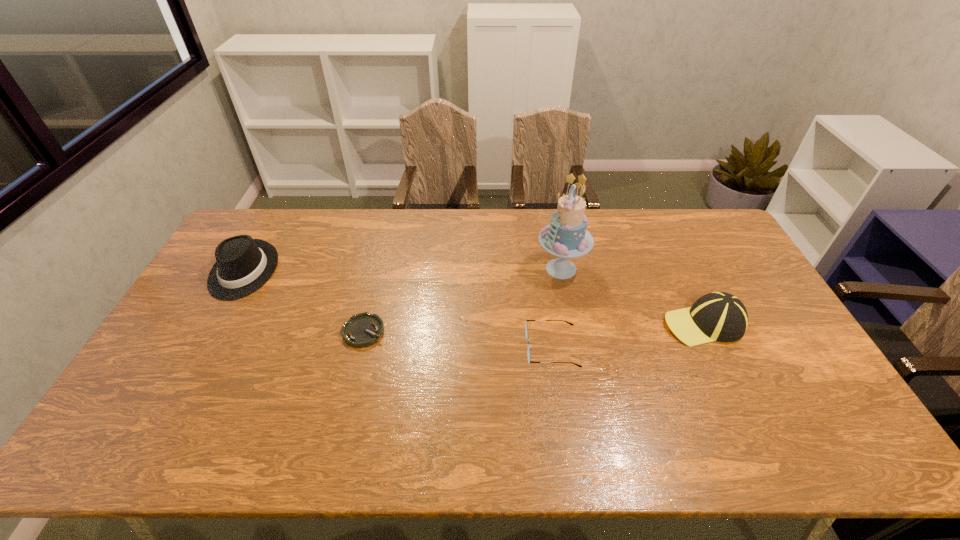
Where is `vacant area between the spectacles and the rightmost object`? vacant area between the spectacles and the rightmost object is located at coordinates (628, 336).

I want to click on vacant area that lies between the tallest object and the second shortest object, so 557,308.

You are a GUI agent. You are given a task and a screenshot of the screen. Output one action in this format:
    pyautogui.click(x=<x>, y=<y>)
    Task: Click on the free point between the spectacles and the fourth object from right to left
    
    Given the screenshot: What is the action you would take?
    pos(458,340)

Identify the location of free spot between the tallest object and the second object from left to right. (463, 300).

Where is `free space between the cake and the spectacles`? free space between the cake and the spectacles is located at coordinates (557, 308).

Locate which object ranks second in proximity to the rightmost object. Please provide its 2D coordinates. Your answer should be formatted as a tuple, i.e. [(x, y)], where the tuple contains the x and y coordinates of a point satisfying the conditions above.

[(526, 329)]

Identify the location of the fourth closest object relative to the baseball cap. (243, 265).

Locate an element on the screen. The width and height of the screenshot is (960, 540). vacant area that satisfies the following two spatial constraints: 1. with a ladder on the side of the cake; 2. on the front-facing side of the fedora is located at coordinates (562, 271).

At what (x,y) coordinates should I click in order to perform the action: click on free space that satisfies the following two spatial constraints: 1. with a ladder on the side of the tallest object; 2. on the front side of the fourth object from right to left. Please return your answer as a coordinate pair (x, y). The image size is (960, 540). Looking at the image, I should click on (573, 332).